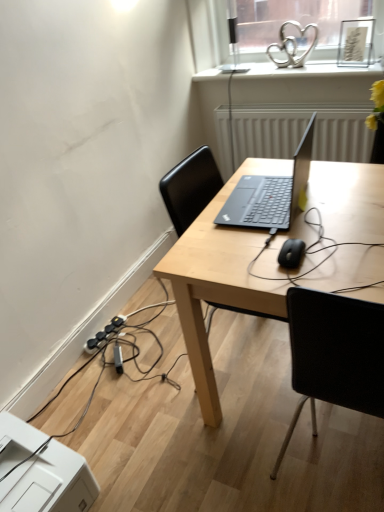
Locate an element on the screen. free space to the left of black matte mouse at center is located at coordinates (240, 261).